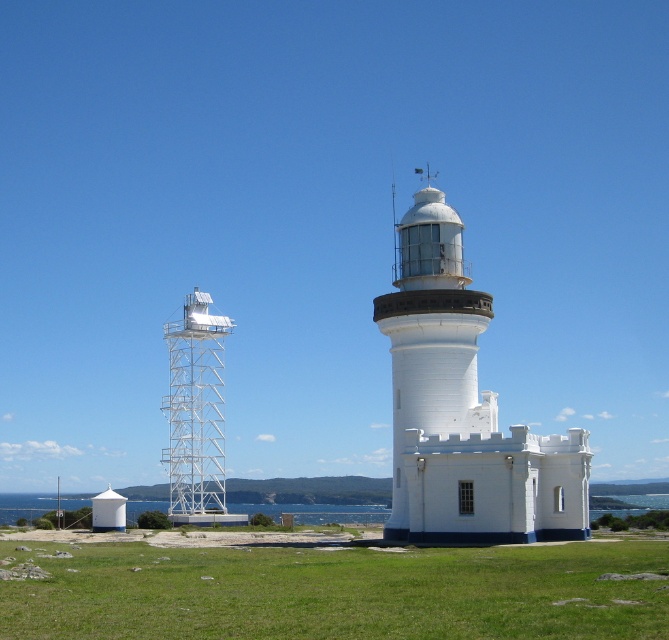
Question: Can you confirm if white smooth lighthouse at center is positioned below white metallic tower at left?

Choices:
 (A) yes
 (B) no

Answer: (B)

Question: Which point appears farthest from the camera in this image?

Choices:
 (A) (195, 436)
 (B) (504, 580)

Answer: (A)

Question: Which of the following is the closest to the observer?

Choices:
 (A) white metallic tower at left
 (B) white smooth lighthouse at center
 (C) green grass at lower center

Answer: (C)

Question: Is green grass at lower center thinner than white metallic tower at left?

Choices:
 (A) no
 (B) yes

Answer: (A)

Question: Is green grass at lower center positioned behind white smooth lighthouse at center?

Choices:
 (A) yes
 (B) no

Answer: (B)

Question: Which point appears closest to the camera in this image?

Choices:
 (A) (201, 372)
 (B) (429, 579)
 (C) (472, 493)

Answer: (B)